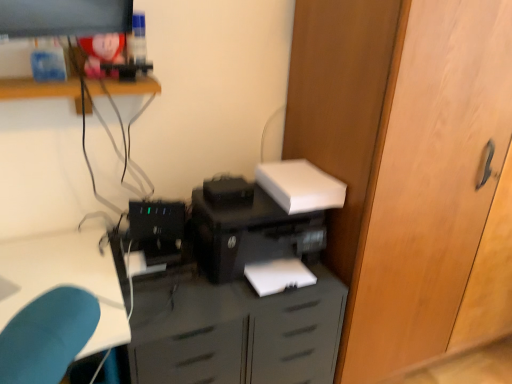
Question: From the image's perspective, is black plastic printer at center on top of wooden door at center-right?

Choices:
 (A) yes
 (B) no

Answer: (B)

Question: From a real-world perspective, is black plastic printer at center positioned under wooden door at center-right based on gravity?

Choices:
 (A) no
 (B) yes

Answer: (B)

Question: From the image's perspective, is black plastic printer at center below wooden door at center-right?

Choices:
 (A) yes
 (B) no

Answer: (A)

Question: Would you say black plastic printer at center is outside wooden door at center-right?

Choices:
 (A) no
 (B) yes

Answer: (B)

Question: Considering the relative sizes of black plastic printer at center and wooden door at center-right in the image provided, is black plastic printer at center shorter than wooden door at center-right?

Choices:
 (A) no
 (B) yes

Answer: (B)

Question: Can you confirm if black plastic printer at center is taller than wooden door at center-right?

Choices:
 (A) no
 (B) yes

Answer: (A)

Question: Is the position of black plastic printer at center more distant than that of black plastic computer tower at center?

Choices:
 (A) yes
 (B) no

Answer: (B)

Question: Does black plastic printer at center appear on the right side of black plastic computer tower at center?

Choices:
 (A) yes
 (B) no

Answer: (A)

Question: From a real-world perspective, is black plastic printer at center over black plastic computer tower at center?

Choices:
 (A) yes
 (B) no

Answer: (B)

Question: Is black plastic printer at center wider than black plastic computer tower at center?

Choices:
 (A) yes
 (B) no

Answer: (A)

Question: Considering the relative positions of black plastic printer at center and black plastic computer tower at center in the image provided, is black plastic printer at center to the left of black plastic computer tower at center from the viewer's perspective?

Choices:
 (A) yes
 (B) no

Answer: (B)

Question: Does black plastic printer at center have a larger size compared to black plastic computer tower at center?

Choices:
 (A) no
 (B) yes

Answer: (B)

Question: Is matte black printer at lower center turned away from wooden door at center-right?

Choices:
 (A) yes
 (B) no

Answer: (B)